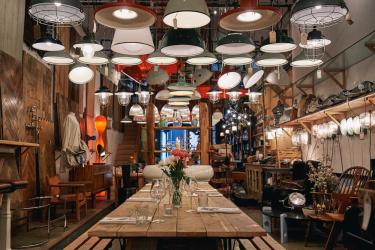
Locate an element on the screen. white wall is located at coordinates (362, 75).